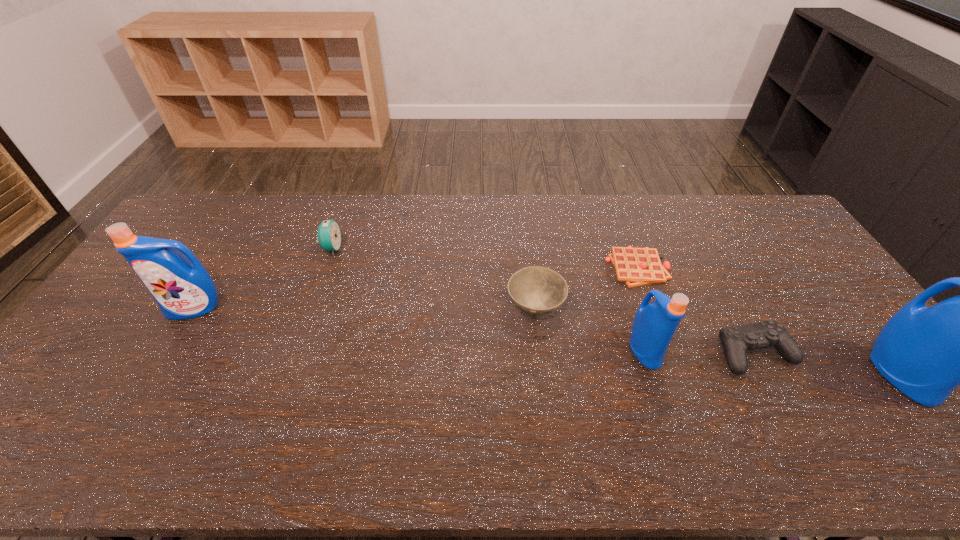
The height and width of the screenshot is (540, 960). Identify the location of object positioned at the right edge. (926, 353).

The width and height of the screenshot is (960, 540). Identify the location of object positioned at the near right corner. (926, 353).

In the image, there is a desktop. Where is `vacant space at the far edge`? The height and width of the screenshot is (540, 960). vacant space at the far edge is located at coordinates (608, 211).

Where is `free point at the near edge`? The image size is (960, 540). free point at the near edge is located at coordinates (479, 420).

Identify the location of vacant space at the near left corner. (90, 401).

This screenshot has width=960, height=540. I want to click on free space at the far right corner, so click(746, 217).

At what (x,y) coordinates should I click in order to perform the action: click on free space at the near right corner of the desktop. Please return your answer as a coordinate pair (x, y). Looking at the image, I should click on (890, 403).

I want to click on empty space between the second shortest detergent and the tallest object, so click(547, 341).

The width and height of the screenshot is (960, 540). Identify the location of free space between the bowl and the shortest object. (587, 288).

Where is `free space between the fifth shortest object and the sixth object from left to right`? Image resolution: width=960 pixels, height=540 pixels. free space between the fifth shortest object and the sixth object from left to right is located at coordinates (700, 352).